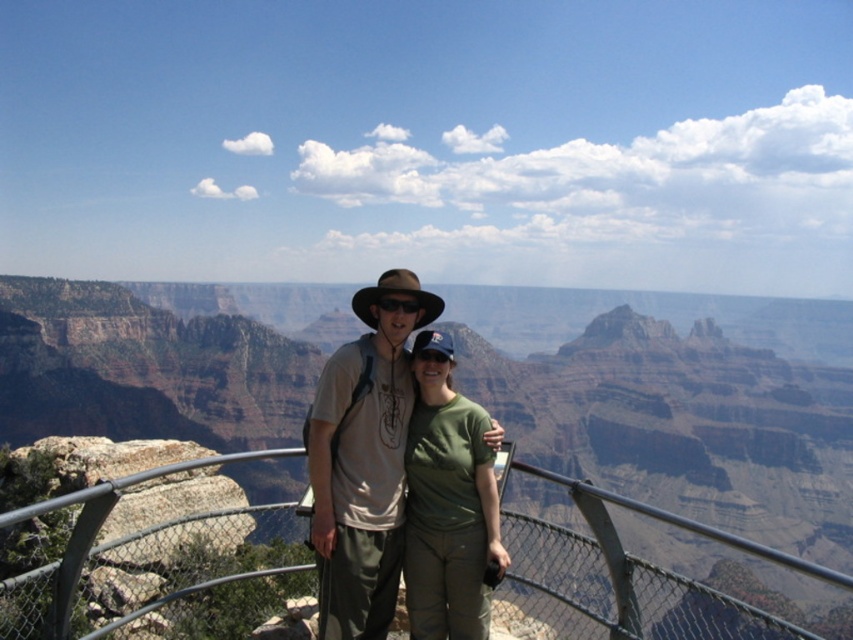
Between point (433, 445) and point (375, 324), which one is positioned behind?

Point (375, 324)

Where is `green matte t-shirt at center`? The width and height of the screenshot is (853, 640). green matte t-shirt at center is located at coordinates (447, 502).

Which is in front, point (322, 508) or point (421, 413)?

Point (322, 508) is in front.

Can you confirm if matte khaki pants at center is positioned below green matte t-shirt at center?

No.

Who is more forward, (320, 604) or (428, 552)?

Point (320, 604) is more forward.

Find the location of a particular element. This screenshot has height=640, width=853. matte khaki pants at center is located at coordinates coord(364,458).

Who is positioned more to the right, matte khaki pants at center or brown fabric cowboy hat at center?

Positioned to the right is matte khaki pants at center.

Is matte khaki pants at center shorter than brown fabric cowboy hat at center?

No, matte khaki pants at center is not shorter than brown fabric cowboy hat at center.

Where is `matte khaki pants at center`? matte khaki pants at center is located at coordinates (364, 458).

Where is `matte khaki pants at center`? The image size is (853, 640). matte khaki pants at center is located at coordinates (364, 458).